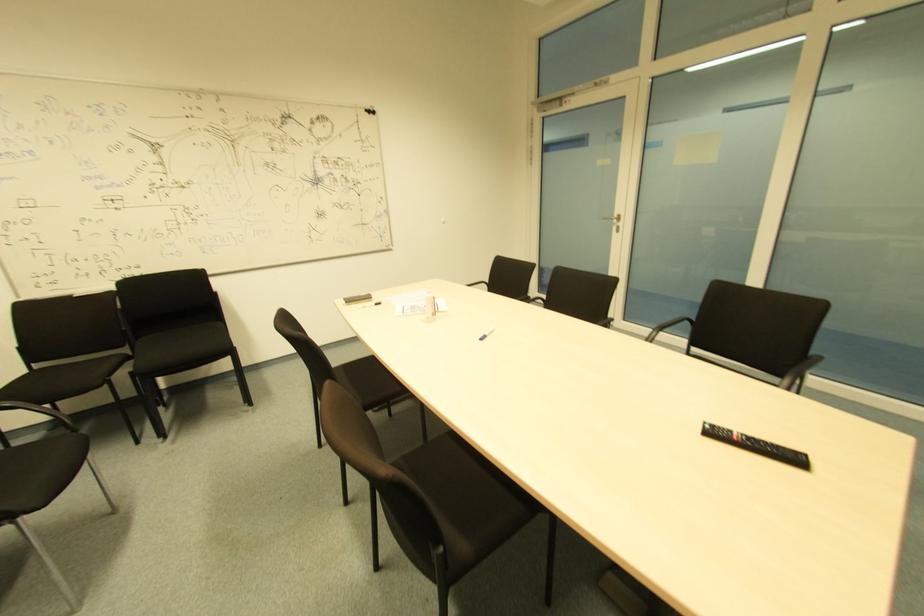
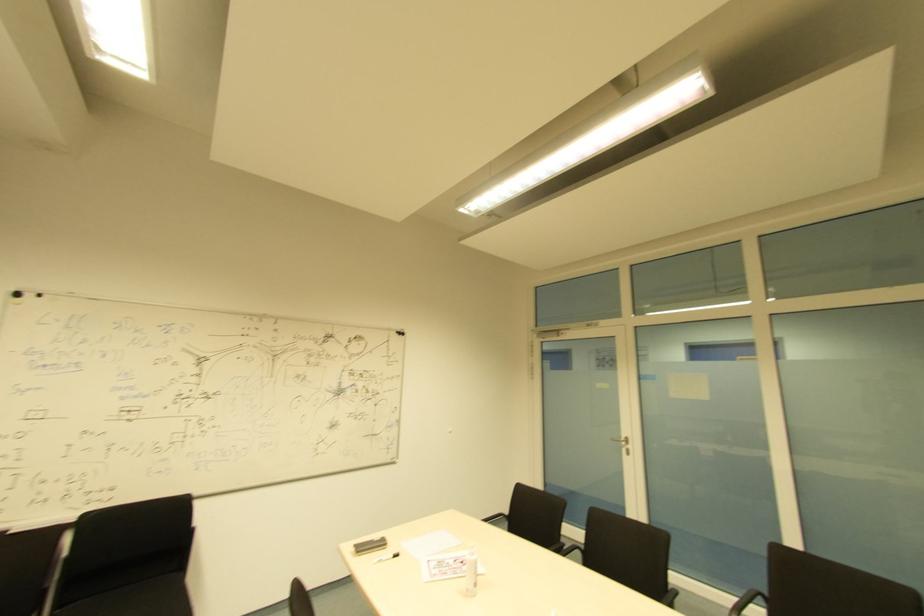
Locate, in the second image, the point that corresponds to point 432,317 in the first image.

(473, 588)